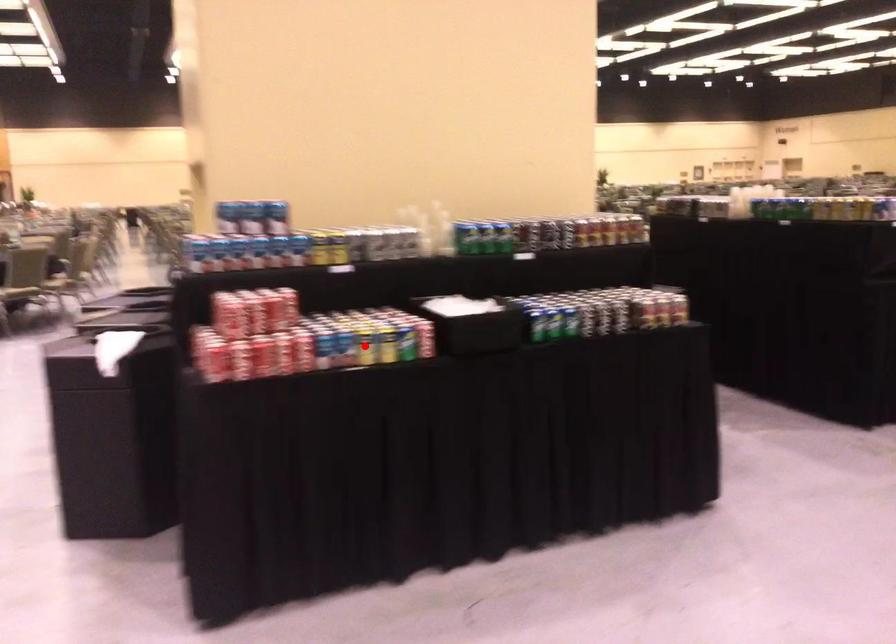
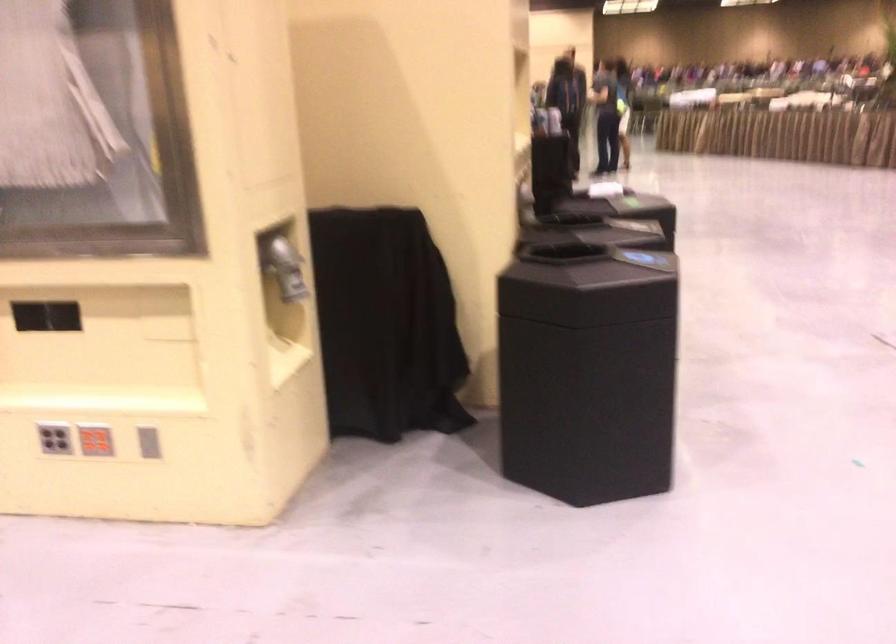
Question: I am providing you with two images of the same scene from different viewpoints. A red point is marked on the first image. Can you still see the location of the red point in image 2?

Choices:
 (A) Yes
 (B) No

Answer: (B)